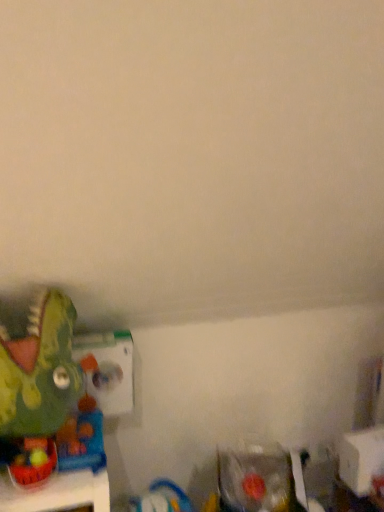
Describe the element at coordinates (34, 462) in the screenshot. The height and width of the screenshot is (512, 384). I see `rubberized green dinosaur at lower left, which is the 3th toy in right-to-left order` at that location.

What are the coordinates of `green matte dinosaur at left, which appears as the 1th toy when viewed from the top` in the screenshot? It's located at (40, 371).

Is green matte dinosaur at left, the 2th toy viewed from the left, inside the boundaries of rubberized green dinosaur at lower left, the first toy in the left-to-right sequence, or outside?

green matte dinosaur at left, the 2th toy viewed from the left, is spatially situated outside rubberized green dinosaur at lower left, the first toy in the left-to-right sequence.

Between green matte dinosaur at left, which appears as the 1th toy when viewed from the top, and rubberized green dinosaur at lower left, which ranks as the 2th toy in bottom-to-top order, which one appears on the right side from the viewer's perspective?

Positioned to the right is green matte dinosaur at left, which appears as the 1th toy when viewed from the top.

Can you tell me how much clear plastic toy at lower right, which ranks as the 3th toy in left-to-right order, and green matte dinosaur at left, which appears as the 1th toy when viewed from the top, differ in facing direction?

The angular difference between clear plastic toy at lower right, which ranks as the 3th toy in left-to-right order, and green matte dinosaur at left, which appears as the 1th toy when viewed from the top, is 23.7 degrees.

Which object is wider, clear plastic toy at lower right, which is the first toy in bottom-to-top order, or green matte dinosaur at left, which appears as the 1th toy when viewed from the top?

With larger width is green matte dinosaur at left, which appears as the 1th toy when viewed from the top.

From a real-world perspective, starting from the green matte dinosaur at left, which appears as the third toy when ordered from the bottom, which toy is the 2nd one below it? Please provide its 2D coordinates.

[(256, 480)]

Would you say clear plastic toy at lower right, marked as the 1th toy in a right-to-left arrangement, is a long distance from green matte dinosaur at left, which appears as the third toy when ordered from the bottom?

No.

The image size is (384, 512). Identify the location of toy lying above the rubberized green dinosaur at lower left, which ranks as the 2th toy in bottom-to-top order (from the image's perspective). (40, 371).

Between point (31, 457) and point (53, 291), which one is positioned in front?

The point (31, 457) is closer.

Is rubberized green dinosaur at lower left, which ranks as the 2th toy in bottom-to-top order, placed right next to green matte dinosaur at left, which appears as the 1th toy when viewed from the top?

No, rubberized green dinosaur at lower left, which ranks as the 2th toy in bottom-to-top order, is not beside green matte dinosaur at left, which appears as the 1th toy when viewed from the top.

Do you think green matte dinosaur at left, which appears as the 1th toy when viewed from the top, is within clear plastic toy at lower right, which ranks as the 3th toy in left-to-right order, or outside of it?

green matte dinosaur at left, which appears as the 1th toy when viewed from the top, is outside clear plastic toy at lower right, which ranks as the 3th toy in left-to-right order.

Is green matte dinosaur at left, which appears as the third toy when ordered from the bottom, in contact with clear plastic toy at lower right, which is the first toy in bottom-to-top order?

There is a gap between green matte dinosaur at left, which appears as the third toy when ordered from the bottom, and clear plastic toy at lower right, which is the first toy in bottom-to-top order.

Based on the photo, which object is thinner, green matte dinosaur at left, positioned as the 2th toy in right-to-left order, or clear plastic toy at lower right, which ranks as the 3th toy in left-to-right order?

With smaller width is clear plastic toy at lower right, which ranks as the 3th toy in left-to-right order.

Considering the positions of point (257, 481) and point (14, 465), is point (257, 481) closer or farther from the camera than point (14, 465)?

Point (257, 481).

Looking at this image, from a real-world perspective, is clear plastic toy at lower right, which ranks as the 3th toy in left-to-right order, above or below rubberized green dinosaur at lower left, the first toy in the left-to-right sequence?

clear plastic toy at lower right, which ranks as the 3th toy in left-to-right order, is situated lower than rubberized green dinosaur at lower left, the first toy in the left-to-right sequence, in the real world.

Looking at this image, measure the distance from clear plastic toy at lower right, which is the first toy in bottom-to-top order, to rubberized green dinosaur at lower left, which is the 2th toy in top-to-bottom order.

clear plastic toy at lower right, which is the first toy in bottom-to-top order, is 28.83 inches from rubberized green dinosaur at lower left, which is the 2th toy in top-to-bottom order.

Can you tell me how much clear plastic toy at lower right, marked as the 1th toy in a right-to-left arrangement, and rubberized green dinosaur at lower left, which is the 2th toy in top-to-bottom order, differ in facing direction?

The angular difference between clear plastic toy at lower right, marked as the 1th toy in a right-to-left arrangement, and rubberized green dinosaur at lower left, which is the 2th toy in top-to-bottom order, is 12.8 degrees.

Between point (35, 466) and point (228, 480), which one is positioned in front?

The point (35, 466) is in front.

Considering the sizes of rubberized green dinosaur at lower left, which is the 2th toy in top-to-bottom order, and clear plastic toy at lower right, marked as the 1th toy in a right-to-left arrangement, in the image, is rubberized green dinosaur at lower left, which is the 2th toy in top-to-bottom order, bigger or smaller than clear plastic toy at lower right, marked as the 1th toy in a right-to-left arrangement,?

Clearly, rubberized green dinosaur at lower left, which is the 2th toy in top-to-bottom order, is smaller in size than clear plastic toy at lower right, marked as the 1th toy in a right-to-left arrangement.

Identify the location of toy positioned vertically above the rubberized green dinosaur at lower left, which is the 2th toy in top-to-bottom order (from a real-world perspective). (40, 371).

Locate an element on the screen. the 2nd toy positioned above the clear plastic toy at lower right, the third toy in the top-to-bottom sequence (from the image's perspective) is located at coordinates (40, 371).

Which object lies nearer to the anchor point clear plastic toy at lower right, which ranks as the 3th toy in left-to-right order, rubberized green dinosaur at lower left, which ranks as the 2th toy in bottom-to-top order, or green matte dinosaur at left, which appears as the 1th toy when viewed from the top?

The object closer to clear plastic toy at lower right, which ranks as the 3th toy in left-to-right order, is green matte dinosaur at left, which appears as the 1th toy when viewed from the top.

Which object lies further to the anchor point rubberized green dinosaur at lower left, which is the 2th toy in top-to-bottom order, clear plastic toy at lower right, which ranks as the 3th toy in left-to-right order, or green matte dinosaur at left, which appears as the 1th toy when viewed from the top?

Based on the image, clear plastic toy at lower right, which ranks as the 3th toy in left-to-right order, appears to be further to rubberized green dinosaur at lower left, which is the 2th toy in top-to-bottom order.

Looking at the image, which one is located further to clear plastic toy at lower right, the third toy in the top-to-bottom sequence, green matte dinosaur at left, positioned as the 2th toy in right-to-left order, or rubberized green dinosaur at lower left, which is the 3th toy in right-to-left order?

rubberized green dinosaur at lower left, which is the 3th toy in right-to-left order, is positioned further to the anchor clear plastic toy at lower right, the third toy in the top-to-bottom sequence.

When comparing their distances from rubberized green dinosaur at lower left, which is the 2th toy in top-to-bottom order, does green matte dinosaur at left, positioned as the 2th toy in right-to-left order, or clear plastic toy at lower right, the third toy in the top-to-bottom sequence, seem closer?

Among the two, green matte dinosaur at left, positioned as the 2th toy in right-to-left order, is located nearer to rubberized green dinosaur at lower left, which is the 2th toy in top-to-bottom order.

Based on their spatial positions, is clear plastic toy at lower right, which ranks as the 3th toy in left-to-right order, or rubberized green dinosaur at lower left, the first toy in the left-to-right sequence, further from green matte dinosaur at left, which appears as the third toy when ordered from the bottom?

clear plastic toy at lower right, which ranks as the 3th toy in left-to-right order, lies further to green matte dinosaur at left, which appears as the third toy when ordered from the bottom, than the other object.

Considering their positions, is rubberized green dinosaur at lower left, which is the 3th toy in right-to-left order, positioned closer to green matte dinosaur at left, which appears as the 1th toy when viewed from the top, than clear plastic toy at lower right, which is the first toy in bottom-to-top order?

The object closer to green matte dinosaur at left, which appears as the 1th toy when viewed from the top, is rubberized green dinosaur at lower left, which is the 3th toy in right-to-left order.

Image resolution: width=384 pixels, height=512 pixels. In order to click on toy between rubberized green dinosaur at lower left, which ranks as the 2th toy in bottom-to-top order, and clear plastic toy at lower right, the third toy in the top-to-bottom sequence, from left to right in this screenshot , I will do `click(40, 371)`.